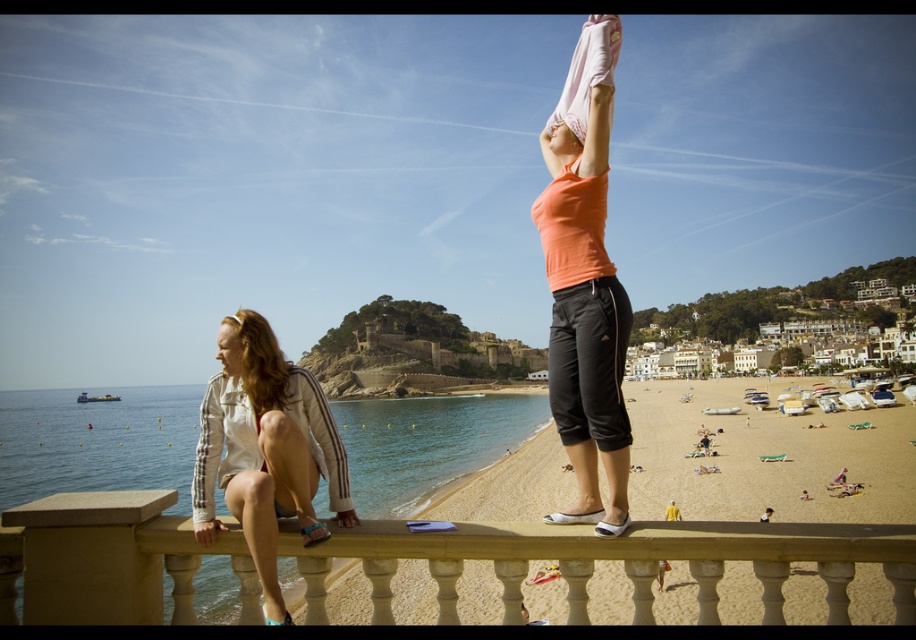
Question: Which object is the farthest from the beige stone balustrade at center?

Choices:
 (A) blonde hair at center
 (B) matte orange tank top at center
 (C) white cotton jacket at lower left
 (D) pink fabric head at upper center

Answer: (D)

Question: Is white cotton jacket at lower left closer to the viewer compared to pink fabric head at upper center?

Choices:
 (A) yes
 (B) no

Answer: (A)

Question: Among these points, which one is nearest to the camera?

Choices:
 (A) (807, 532)
 (B) (562, 120)
 (C) (274, 353)

Answer: (A)

Question: Does white cotton jacket at lower left appear under pink fabric head at upper center?

Choices:
 (A) no
 (B) yes

Answer: (B)

Question: Which point is closer to the camera?

Choices:
 (A) white cotton jacket at lower left
 (B) pink fabric head at upper center
 (C) beige stone balustrade at center

Answer: (C)

Question: Does beige stone balustrade at center appear on the left side of pink fabric head at upper center?

Choices:
 (A) no
 (B) yes

Answer: (B)